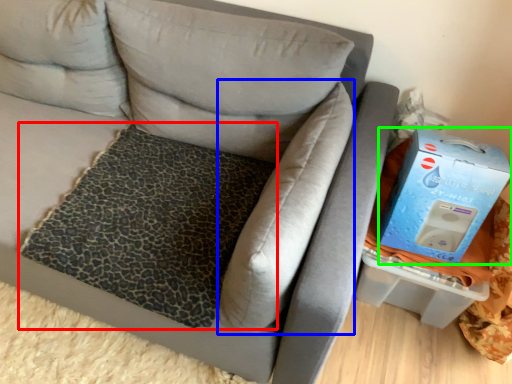
Question: Which is nearer to the mat (highlighted by a red box)? pillow (highlighted by a blue box) or box (highlighted by a green box).

Choices:
 (A) pillow
 (B) box

Answer: (A)